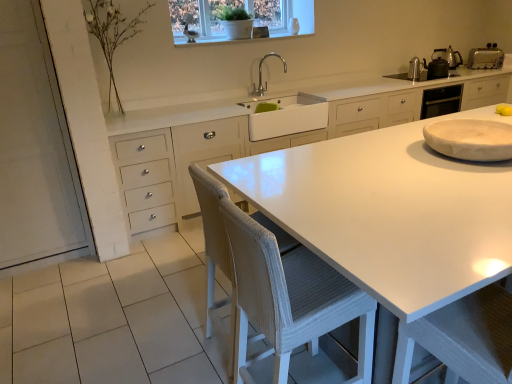
Question: Is silver metallic faucet at upper center bigger than white marble plate at right, placed as the 1th appliance when sorted from front to back?

Choices:
 (A) yes
 (B) no

Answer: (B)

Question: From the image's perspective, does silver metallic faucet at upper center appear lower than white marble plate at right, acting as the 1th appliance starting from the bottom?

Choices:
 (A) no
 (B) yes

Answer: (A)

Question: From a real-world perspective, is silver metallic faucet at upper center below white marble plate at right, placed as the 1th appliance when sorted from front to back?

Choices:
 (A) no
 (B) yes

Answer: (A)

Question: From the image's perspective, would you say silver metallic faucet at upper center is positioned over white marble plate at right, which is the 4th appliance from top to bottom?

Choices:
 (A) yes
 (B) no

Answer: (A)

Question: Considering the relative sizes of silver metallic faucet at upper center and white marble plate at right, positioned as the 1th appliance in left-to-right order, in the image provided, is silver metallic faucet at upper center smaller than white marble plate at right, positioned as the 1th appliance in left-to-right order,?

Choices:
 (A) no
 (B) yes

Answer: (B)

Question: Is white glossy countertop at center in front of or behind white glossy window at upper center in the image?

Choices:
 (A) front
 (B) behind

Answer: (A)

Question: Considering the positions of white glossy countertop at center and white glossy window at upper center in the image, is white glossy countertop at center bigger or smaller than white glossy window at upper center?

Choices:
 (A) big
 (B) small

Answer: (A)

Question: Would you say white glossy countertop at center is to the left or to the right of white glossy window at upper center in the picture?

Choices:
 (A) right
 (B) left

Answer: (A)

Question: In terms of width, does white glossy countertop at center look wider or thinner when compared to white glossy window at upper center?

Choices:
 (A) wide
 (B) thin

Answer: (A)

Question: Is yellow matte lemon at upper right wider or thinner than metallic silver kettle at upper right, arranged as the fourth appliance when viewed from the front?

Choices:
 (A) thin
 (B) wide

Answer: (A)

Question: Considering the relative positions of yellow matte lemon at upper right and metallic silver kettle at upper right, which appears as the 1th appliance when viewed from the back, in the image provided, is yellow matte lemon at upper right to the left or to the right of metallic silver kettle at upper right, which appears as the 1th appliance when viewed from the back,?

Choices:
 (A) left
 (B) right

Answer: (A)

Question: From the image's perspective, is yellow matte lemon at upper right above or below metallic silver kettle at upper right, which is the first appliance from top to bottom?

Choices:
 (A) above
 (B) below

Answer: (B)

Question: Considering the positions of yellow matte lemon at upper right and metallic silver kettle at upper right, arranged as the fourth appliance when viewed from the front, in the image, is yellow matte lemon at upper right bigger or smaller than metallic silver kettle at upper right, arranged as the fourth appliance when viewed from the front,?

Choices:
 (A) big
 (B) small

Answer: (B)

Question: From a real-world perspective, relative to silver metallic faucet at upper center, is white marble plate at right, the fourth appliance in the right-to-left sequence, vertically above or below?

Choices:
 (A) below
 (B) above

Answer: (A)

Question: Is white marble plate at right, positioned as the 1th appliance in left-to-right order, in front of or behind silver metallic faucet at upper center in the image?

Choices:
 (A) behind
 (B) front

Answer: (B)